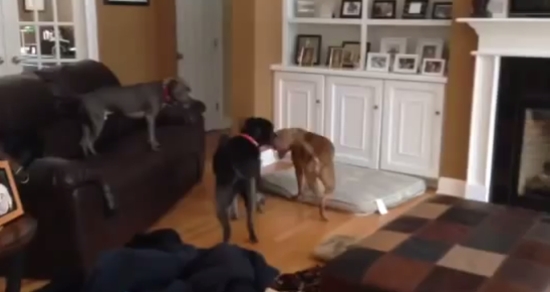
I want to click on mantle, so click(x=472, y=18), click(x=544, y=19).